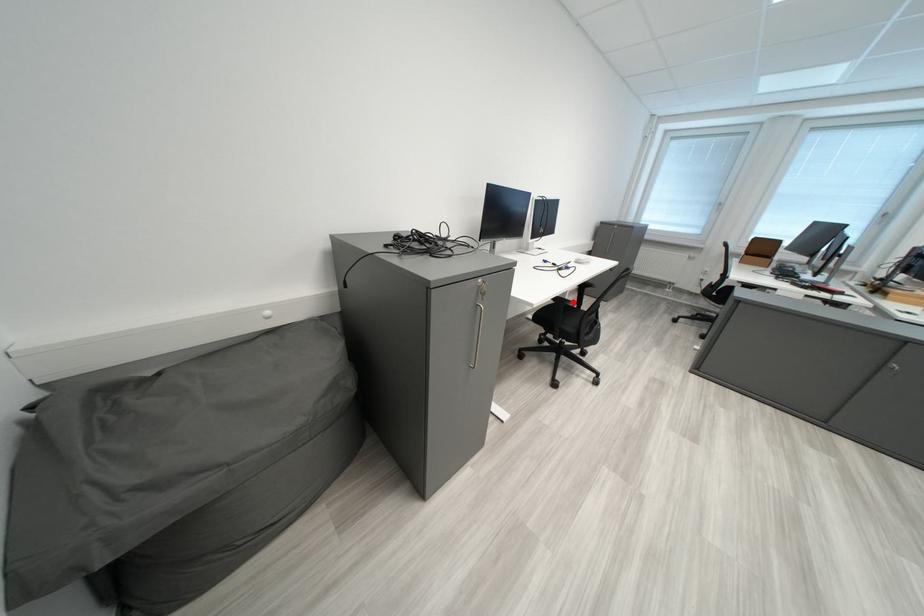
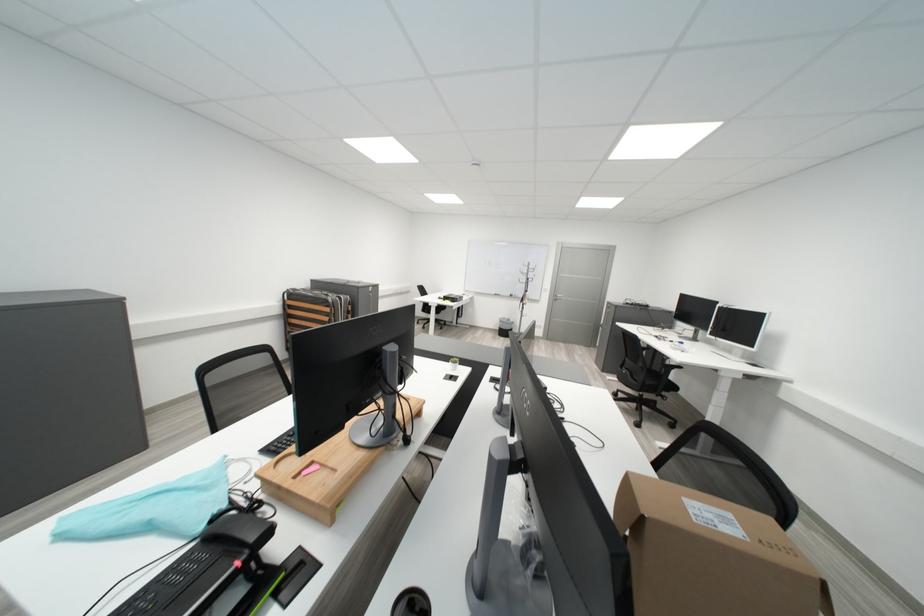
Question: I am providing you with two images of the same scene from different viewpoints. A red point is marked on the first image. Is the red point's position out of view in image 2?

Choices:
 (A) Yes
 (B) No

Answer: (A)